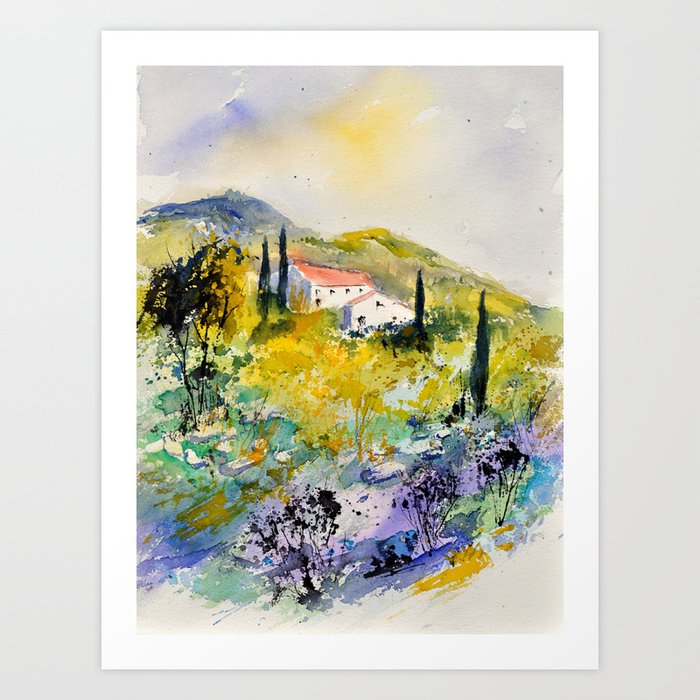
Where is `watercolor painting`? The height and width of the screenshot is (700, 700). watercolor painting is located at coordinates (409, 400).